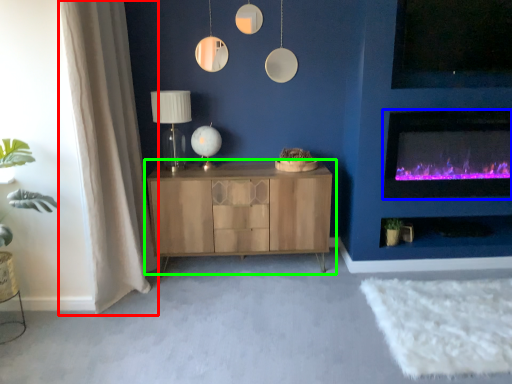
Question: Considering the real-world distances, which object is closest to curtain (highlighted by a red box)? wood burning stove (highlighted by a blue box) or cabinetry (highlighted by a green box).

Choices:
 (A) wood burning stove
 (B) cabinetry

Answer: (B)